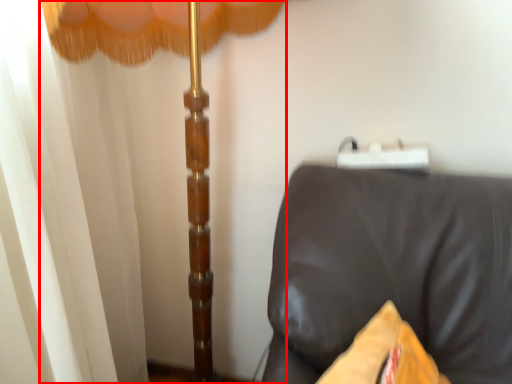
Question: From the image's perspective, considering the relative positions of curtain (annotated by the red box) and furniture in the image provided, where is curtain (annotated by the red box) located with respect to the staircase?

Choices:
 (A) below
 (B) above

Answer: (B)